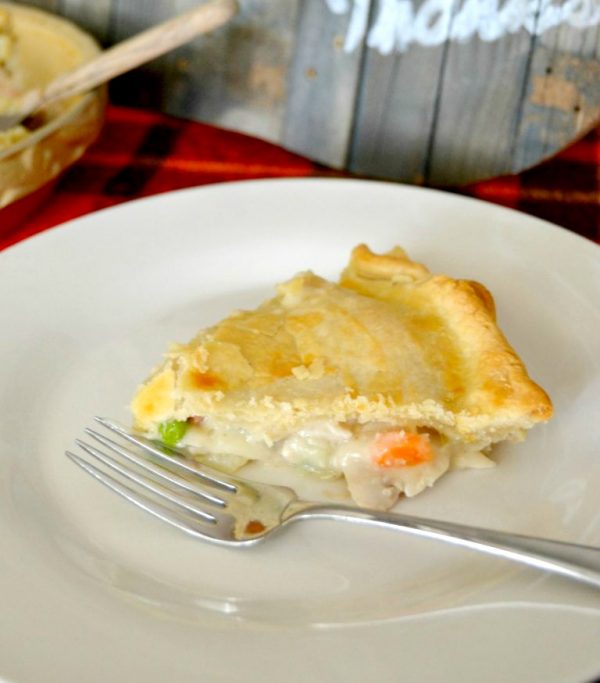
Image resolution: width=600 pixels, height=683 pixels. In order to click on fork in this screenshot , I will do `click(298, 513)`.